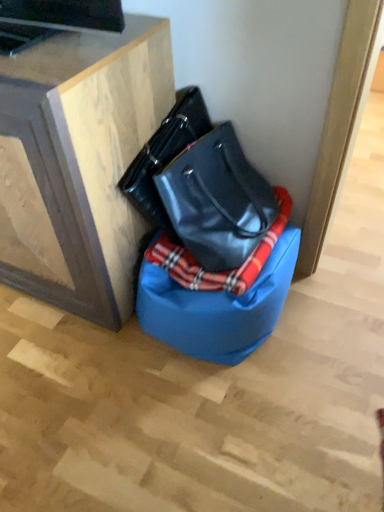
Question: From the image's perspective, is wooden cabinet at upper left above plaid fabric blanket at center?

Choices:
 (A) yes
 (B) no

Answer: (A)

Question: Would you say wooden cabinet at upper left contains plaid fabric blanket at center?

Choices:
 (A) yes
 (B) no

Answer: (B)

Question: Can you confirm if wooden cabinet at upper left is positioned to the left of plaid fabric blanket at center?

Choices:
 (A) no
 (B) yes

Answer: (B)

Question: Could you tell me if wooden cabinet at upper left is turned towards plaid fabric blanket at center?

Choices:
 (A) no
 (B) yes

Answer: (A)

Question: From a real-world perspective, does wooden cabinet at upper left sit lower than plaid fabric blanket at center?

Choices:
 (A) no
 (B) yes

Answer: (A)

Question: Is glossy black handbag at center spatially inside plaid fabric blanket at center, or outside of it?

Choices:
 (A) inside
 (B) outside

Answer: (B)

Question: Based on their positions, is glossy black handbag at center located to the left or right of plaid fabric blanket at center?

Choices:
 (A) right
 (B) left

Answer: (B)

Question: Is glossy black handbag at center taller or shorter than plaid fabric blanket at center?

Choices:
 (A) short
 (B) tall

Answer: (B)

Question: Is glossy black handbag at center in front of or behind plaid fabric blanket at center in the image?

Choices:
 (A) front
 (B) behind

Answer: (A)

Question: Considering the positions of point (198, 325) and point (157, 238), is point (198, 325) closer or farther from the camera than point (157, 238)?

Choices:
 (A) farther
 (B) closer

Answer: (B)

Question: In the image, is blue fabric bean bag chair at lower center on the left side or the right side of plaid fabric blanket at center?

Choices:
 (A) right
 (B) left

Answer: (B)

Question: Looking at the image, does blue fabric bean bag chair at lower center seem bigger or smaller compared to plaid fabric blanket at center?

Choices:
 (A) small
 (B) big

Answer: (B)

Question: Choose the correct answer: Is blue fabric bean bag chair at lower center inside plaid fabric blanket at center or outside it?

Choices:
 (A) outside
 (B) inside

Answer: (A)

Question: In the image, is glossy black handbag at center positioned in front of or behind wooden cabinet at upper left?

Choices:
 (A) front
 (B) behind

Answer: (B)

Question: From the image's perspective, is glossy black handbag at center located above or below wooden cabinet at upper left?

Choices:
 (A) above
 (B) below

Answer: (B)